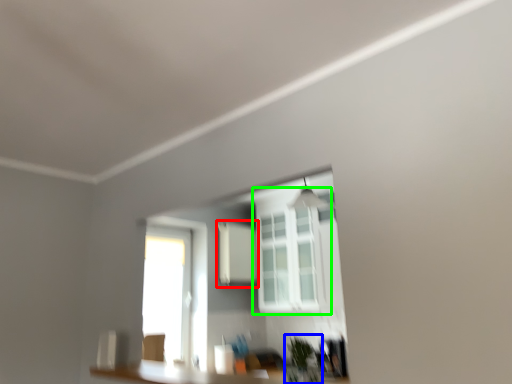
Question: Which is nearer to the medicine cabinet (highlighted by a red box)? plant (highlighted by a blue box) or window (highlighted by a green box).

Choices:
 (A) plant
 (B) window

Answer: (B)